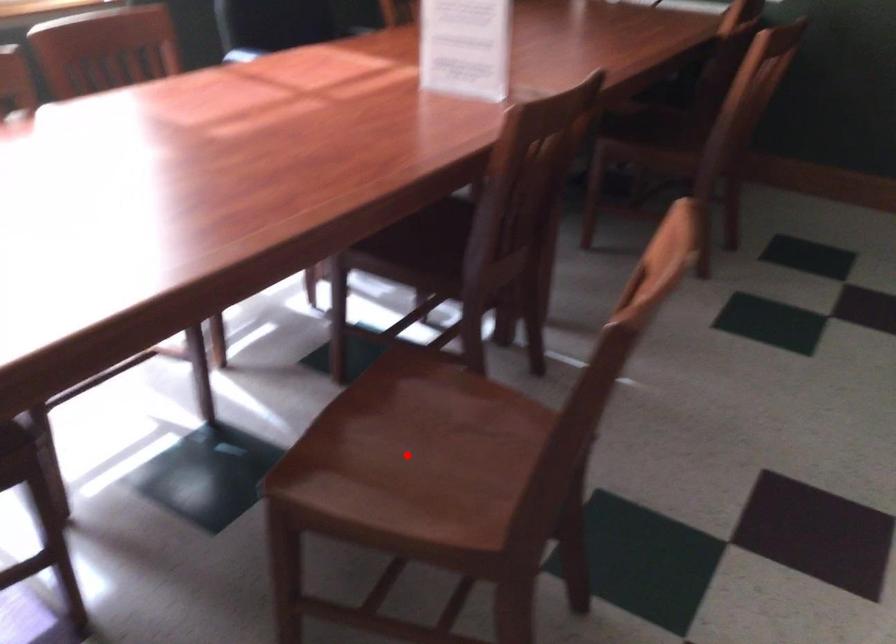
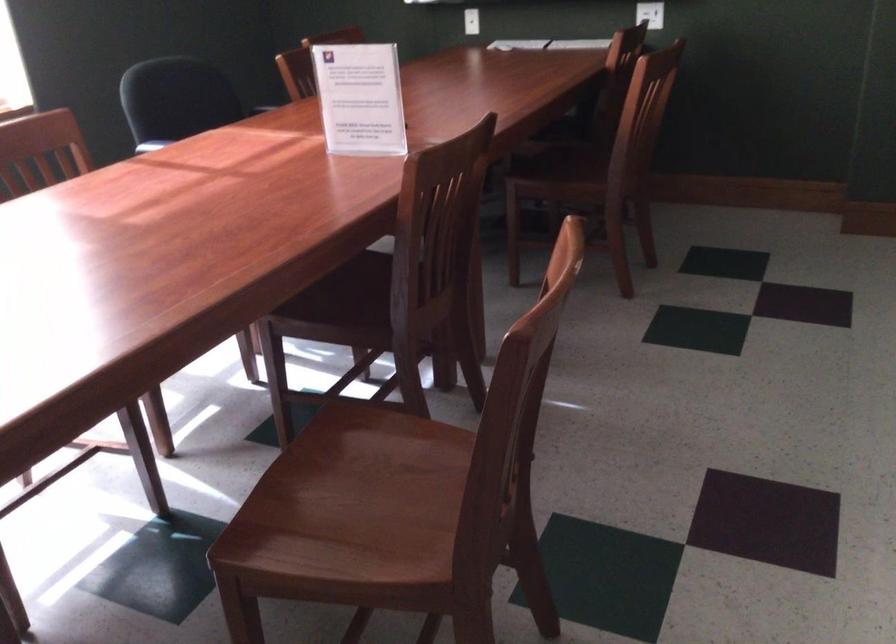
Question: I am providing you with two images of the same scene from different viewpoints. A red point is marked on the first image. At the location where the point appears in image 1, is it still visible in image 2?

Choices:
 (A) Yes
 (B) No

Answer: (A)